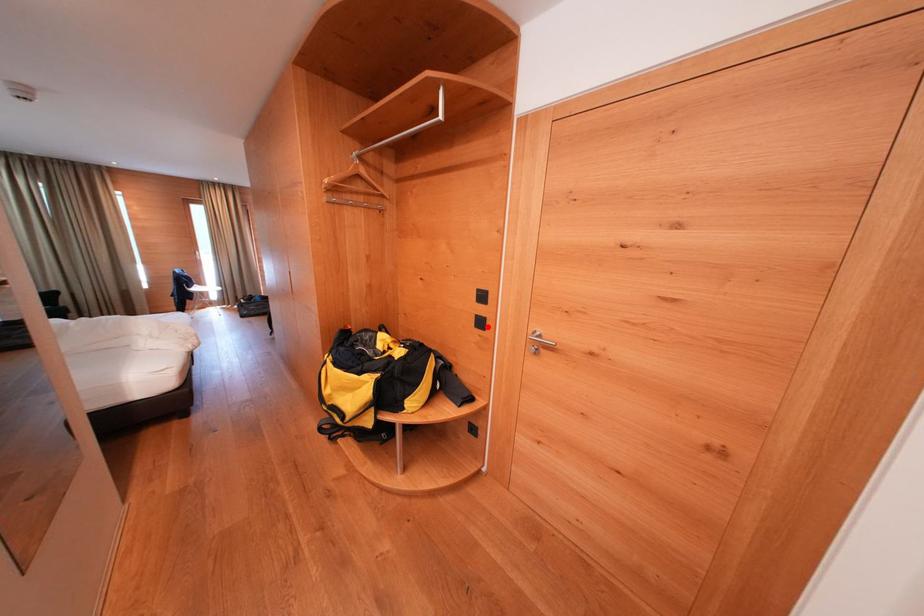
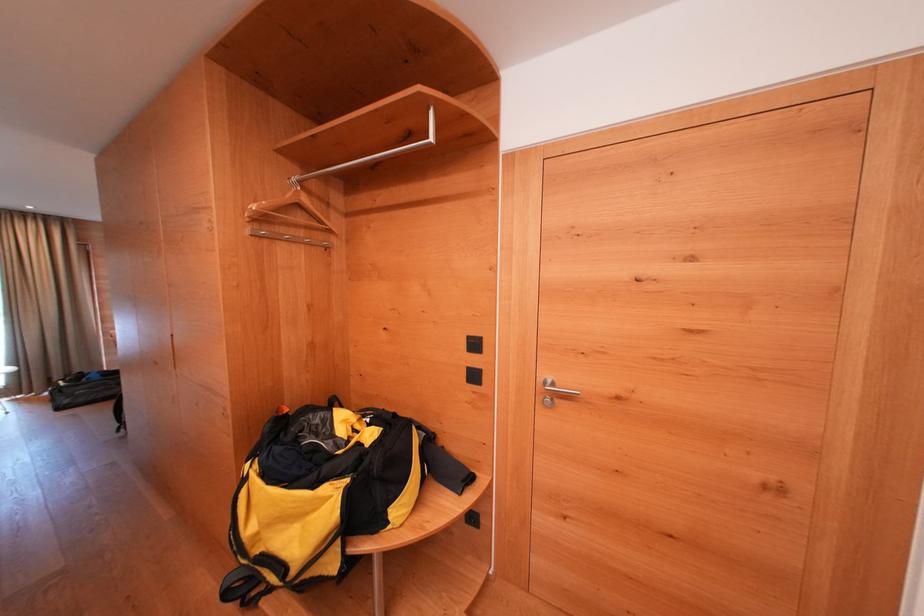
The point at the highlighted location is marked in the first image. Where is the corresponding point in the second image?

(481, 381)